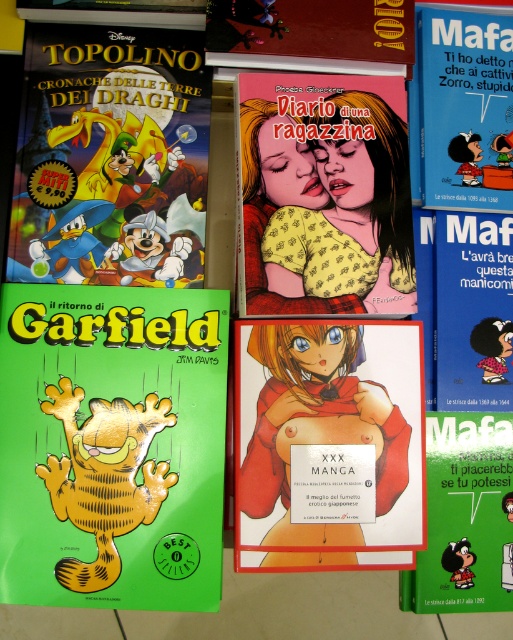
You are organizing a shelf and see the matte yellow garfield at center and the matte red book at upper center. Which one is more to the right?

The matte yellow garfield at center is more to the right than the matte red book at upper center.

You are standing in front of a shelf of comic books and manga volumes. You see a green glossy Garfield at lower left and a camera. How far apart are these two items?

The green glossy Garfield at lower left and the camera are 65.09 centimeters apart.

You are organizing a comic book shelf and notice two Garfield comic books. The green glossy Garfield at lower left and the matte yellow Garfield at center. Which one has a greater width?

The green glossy Garfield at lower left has a greater width than the matte yellow Garfield at center.